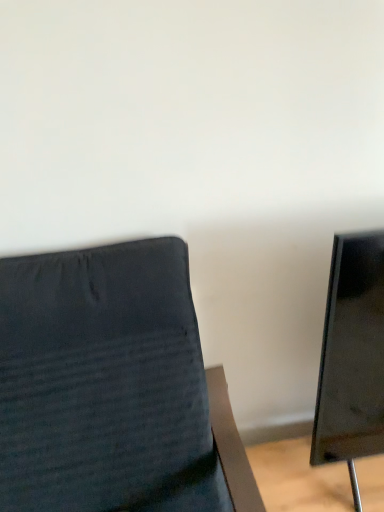
Locate an element on the screen. The image size is (384, 512). dark fabric chair at left is located at coordinates (113, 388).

Looking at this image, measure the distance between dark fabric chair at left and camera.

dark fabric chair at left and camera are 35.35 inches apart from each other.

What is the approximate height of dark fabric chair at left?

dark fabric chair at left is 37.41 inches tall.

What do you see at coordinates (113, 388) in the screenshot? This screenshot has width=384, height=512. I see `dark fabric chair at left` at bounding box center [113, 388].

The height and width of the screenshot is (512, 384). Identify the location of dark fabric chair at left. (113, 388).